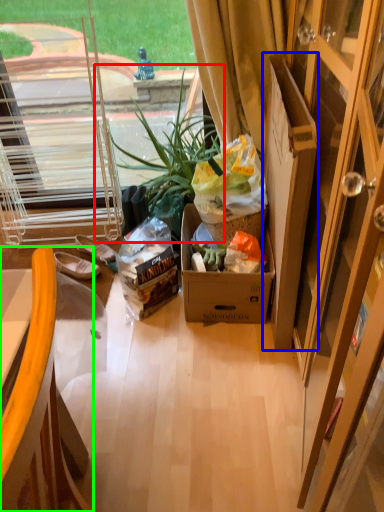
Question: Estimate the real-world distances between objects in this image. Which object is farther from houseplant (highlighted by a red box), cardboard box (highlighted by a blue box) or chair (highlighted by a green box)?

Choices:
 (A) cardboard box
 (B) chair

Answer: (B)